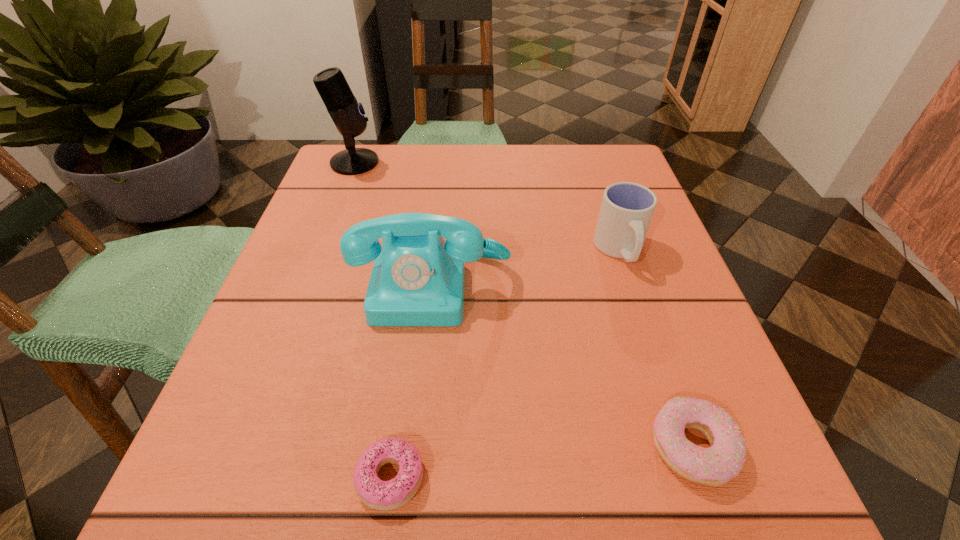
Identify the location of the farthest object. (347, 114).

Where is `the leftmost object`? the leftmost object is located at coordinates (347, 114).

At what (x,y) coordinates should I click in order to perform the action: click on telephone. Please return your answer as a coordinate pair (x, y). Looking at the image, I should click on (417, 279).

Locate an element on the screen. cup is located at coordinates (627, 208).

Locate an element on the screen. The height and width of the screenshot is (540, 960). the taller doughnut is located at coordinates (717, 465).

Find the location of a particular element. the right doughnut is located at coordinates [717, 465].

The width and height of the screenshot is (960, 540). What are the coordinates of `the left doughnut` in the screenshot? It's located at (381, 495).

The image size is (960, 540). Find the location of `the shorter doughnut`. the shorter doughnut is located at coordinates (381, 495).

Where is `free spot located on the stand of the farthest object`? This screenshot has height=540, width=960. free spot located on the stand of the farthest object is located at coordinates (429, 163).

Where is `free space located on the dial of the second tallest object`? This screenshot has width=960, height=540. free space located on the dial of the second tallest object is located at coordinates (419, 415).